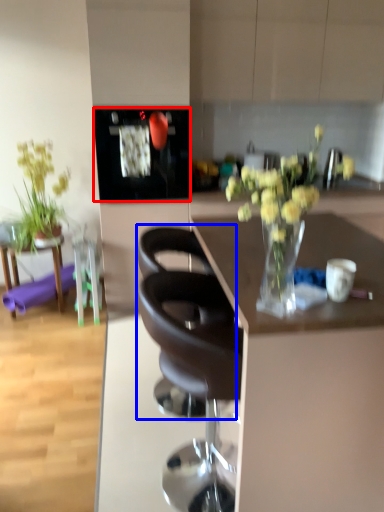
Question: Which object appears closest to the camera in this image, appliance (highlighted by a red box) or chair (highlighted by a blue box)?

Choices:
 (A) appliance
 (B) chair

Answer: (B)